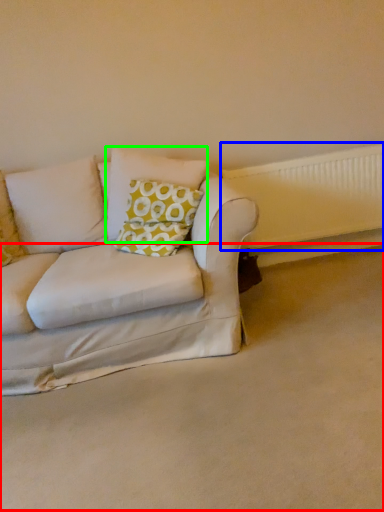
Question: Which object is the farthest from plain (highlighted by a red box)? Choose among these: radiator (highlighted by a blue box) or pillow (highlighted by a green box).

Choices:
 (A) radiator
 (B) pillow

Answer: (A)